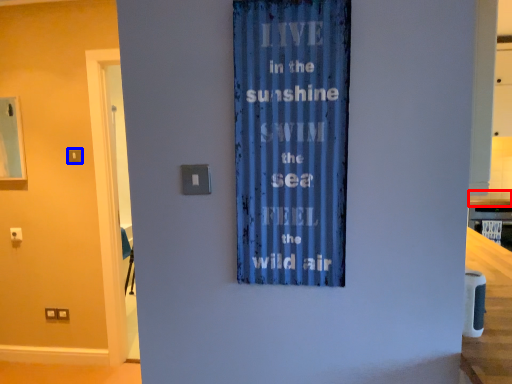
Question: Which object appears farthest to the camera in this image, counter top (highlighted by a red box) or light switch (highlighted by a blue box)?

Choices:
 (A) counter top
 (B) light switch

Answer: (A)